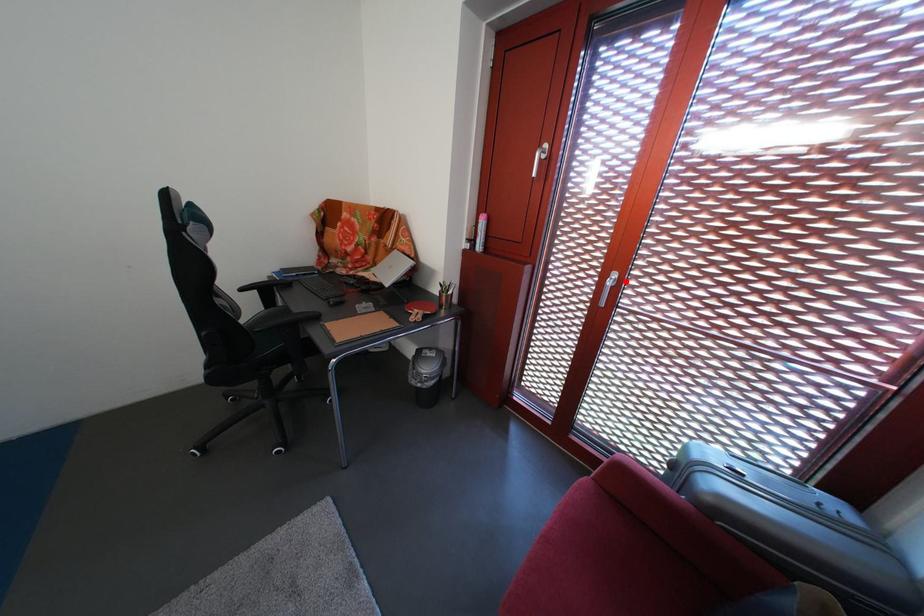
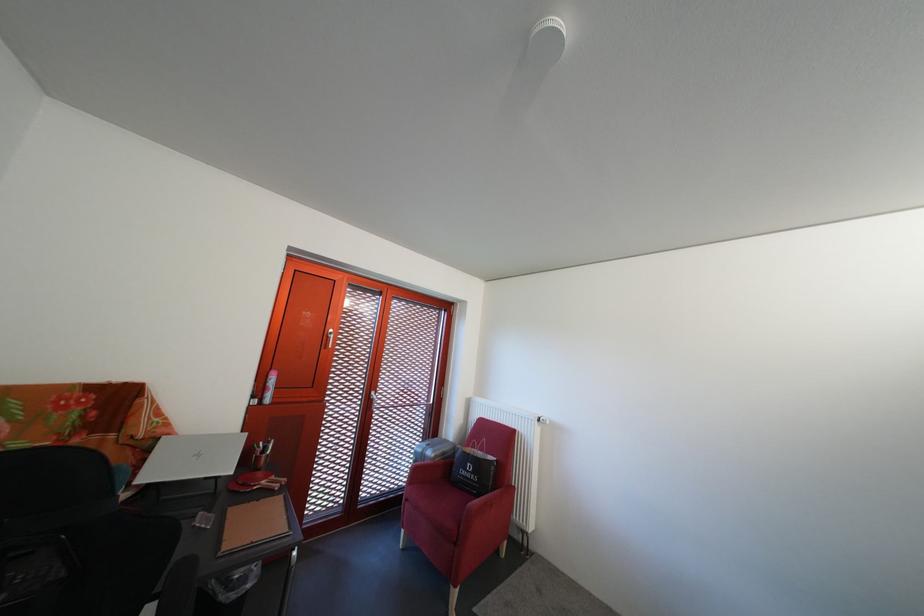
Question: I am providing you with two images of the same scene from different viewpoints. Given a red point in image1, look at the same physical point in image2. Is it:

Choices:
 (A) Closer to the viewpoint
 (B) Farther from the viewpoint

Answer: (B)